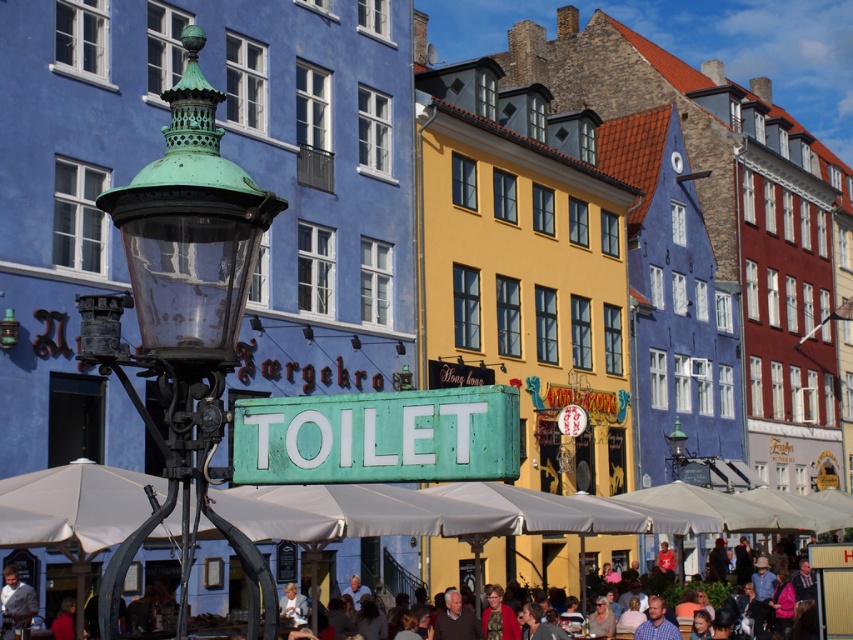
Question: Is green patina metal streetlamp at upper left thinner than green matte toilet sign at center?

Choices:
 (A) no
 (B) yes

Answer: (A)

Question: From the image, what is the correct spatial relationship of green matte toilet sign at center in relation to light brown leather jacket at lower left?

Choices:
 (A) right
 (B) left

Answer: (A)

Question: Among these points, which one is nearest to the camera?

Choices:
 (A) (86, 609)
 (B) (6, 628)

Answer: (B)

Question: Observing the image, what is the correct spatial positioning of light brown wooden chair at lower center in reference to light brown leather jacket at lower left?

Choices:
 (A) right
 (B) left

Answer: (A)

Question: Which of the following is the closest to the observer?

Choices:
 (A) green matte toilet sign at center
 (B) light brown wooden chair at lower center
 (C) green patina metal streetlamp at upper left
 (D) light brown leather jacket at lower left

Answer: (A)

Question: Which of the following is the farthest from the observer?

Choices:
 (A) green patina metal streetlamp at upper left
 (B) green matte toilet sign at center
 (C) light brown wooden chair at lower center
 (D) light brown leather jacket at lower left

Answer: (D)